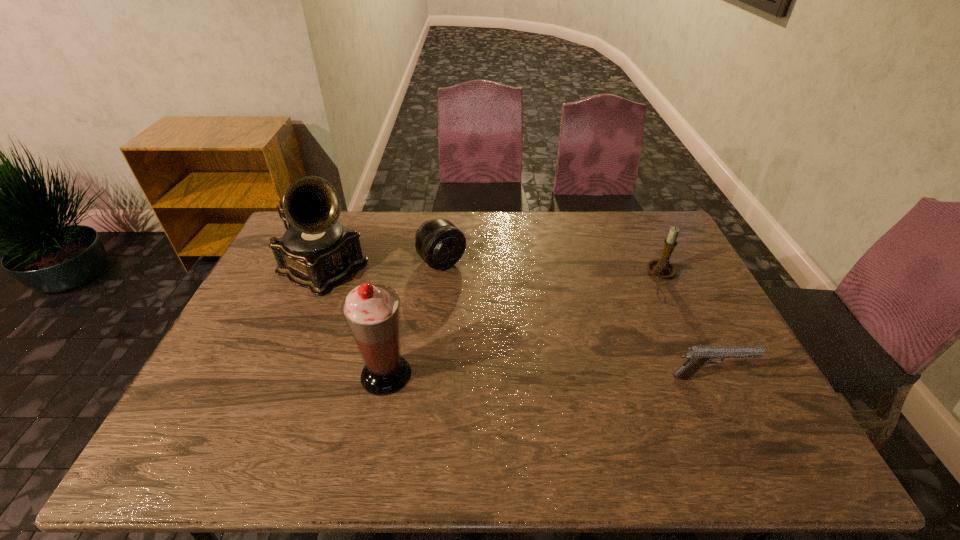
Locate an element on the screen. object identified as the third closest to the fourth tallest object is located at coordinates (662, 268).

I want to click on vacant space that satisfies the following two spatial constraints: 1. on the front side of the telephoto lens; 2. at the barrel of the shortest object, so click(429, 377).

Where is `free space that satisfies the following two spatial constraints: 1. on the front side of the phonograph record; 2. at the barrel of the shortest object`? The width and height of the screenshot is (960, 540). free space that satisfies the following two spatial constraints: 1. on the front side of the phonograph record; 2. at the barrel of the shortest object is located at coordinates (276, 377).

Where is `vacant point that satisfies the following two spatial constraints: 1. on the front side of the phonograph record; 2. on the left side of the smoothie`? Image resolution: width=960 pixels, height=540 pixels. vacant point that satisfies the following two spatial constraints: 1. on the front side of the phonograph record; 2. on the left side of the smoothie is located at coordinates (277, 374).

In order to click on free spot that satisfies the following two spatial constraints: 1. on the front side of the fourth tallest object; 2. at the barrel of the pistol in this screenshot , I will do `click(429, 377)`.

This screenshot has width=960, height=540. I want to click on free spot that satisfies the following two spatial constraints: 1. on the back side of the telephoto lens; 2. on the left side of the leftmost object, so click(325, 261).